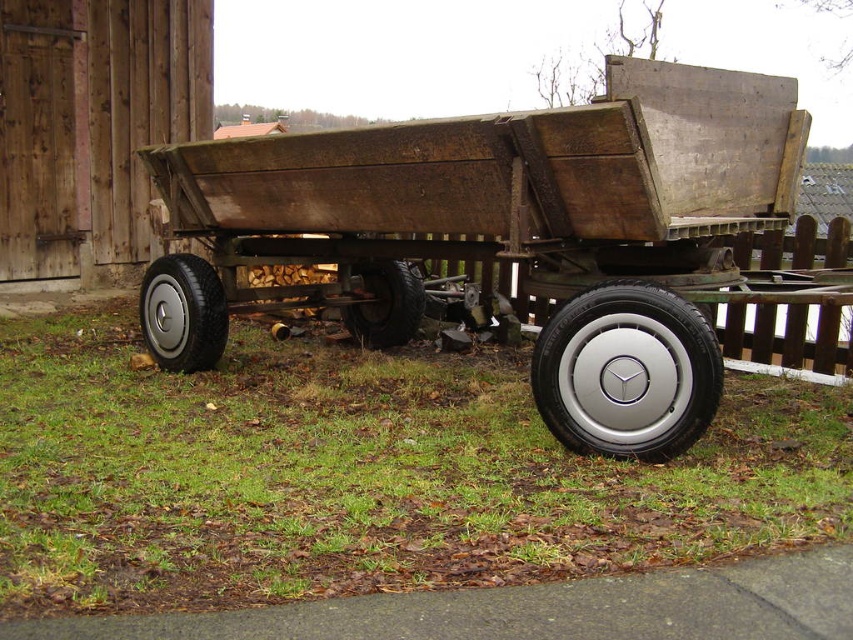
From the picture: Does green grass at lower center have a smaller size compared to silver metallic wheel at center?

Actually, green grass at lower center might be larger than silver metallic wheel at center.

Between point (376, 550) and point (550, 353), which one is positioned behind?

Positioned behind is point (550, 353).

Describe the element at coordinates (363, 474) in the screenshot. I see `green grass at lower center` at that location.

Find the location of `green grass at lower center`. green grass at lower center is located at coordinates (363, 474).

Does silver metallic wheel at center have a larger size compared to silver metallic wheel at lower left?

No.

In the scene shown: Who is taller, silver metallic wheel at center or silver metallic wheel at lower left?

Standing taller between the two is silver metallic wheel at center.

Locate an element on the screen. This screenshot has width=853, height=640. silver metallic wheel at center is located at coordinates (625, 372).

Find the location of a particular element. The width and height of the screenshot is (853, 640). silver metallic wheel at center is located at coordinates (625, 372).

Is point (329, 348) farther from viewer compared to point (415, 275)?

No.

Does green grass at lower center appear under rubber/textured wheel at center?

Indeed, green grass at lower center is positioned under rubber/textured wheel at center.

At what (x,y) coordinates should I click in order to perform the action: click on green grass at lower center. Please return your answer as a coordinate pair (x, y). This screenshot has height=640, width=853. Looking at the image, I should click on (363, 474).

This screenshot has height=640, width=853. I want to click on green grass at lower center, so click(x=363, y=474).